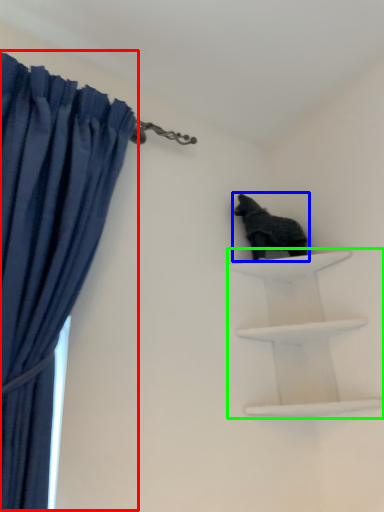
Question: Based on their relative distances, which object is nearer to curtain (highlighted by a red box)? Choose from animal (highlighted by a blue box) and shelf (highlighted by a green box).

Choices:
 (A) animal
 (B) shelf

Answer: (A)